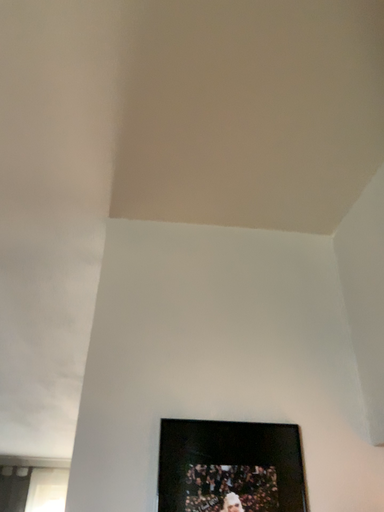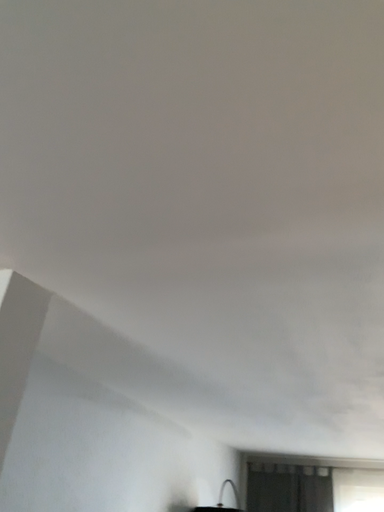
Question: Which way did the camera rotate in the video?

Choices:
 (A) rotated right
 (B) rotated left

Answer: (B)